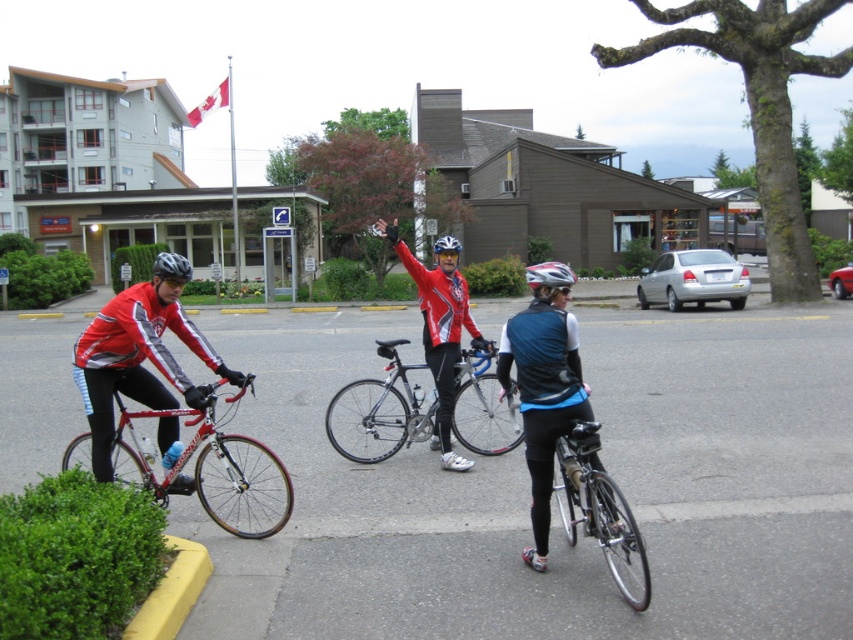
Which is behind, point (213, 442) or point (183, 260)?

Positioned behind is point (183, 260).

Is shiny red bicycle at left bigger than shiny black helmet at left?

Actually, shiny red bicycle at left might be smaller than shiny black helmet at left.

This screenshot has width=853, height=640. In order to click on shiny red bicycle at left in this screenshot , I will do [213, 468].

I want to click on shiny red bicycle at left, so 213,468.

Is point (457, 454) in front of point (560, 264)?

Yes, point (457, 454) is closer to viewer.

I want to click on shiny red jacket at center, so click(x=439, y=333).

What do you see at coordinates (171, 266) in the screenshot? The height and width of the screenshot is (640, 853). I see `shiny black helmet at left` at bounding box center [171, 266].

Does shiny black helmet at left appear over matte black helmet at center?

Actually, shiny black helmet at left is below matte black helmet at center.

Measure the distance between shiny black helmet at left and camera.

The distance of shiny black helmet at left from camera is 17.39 feet.

You are a GUI agent. You are given a task and a screenshot of the screen. Output one action in this format:
    pyautogui.click(x=<x>, y=<y>)
    Task: Click on the shiny black helmet at left
    This screenshot has width=853, height=640.
    Given the screenshot: What is the action you would take?
    pyautogui.click(x=171, y=266)